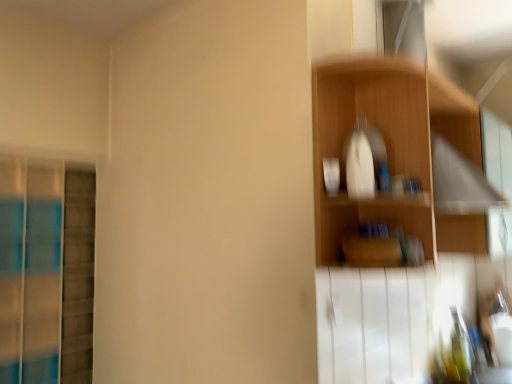
Question: Should I look upward or downward to see wooden shelf at upper right?

Choices:
 (A) down
 (B) up

Answer: (B)

Question: Is blue glass screen door at left bigger than wooden shelf at upper right?

Choices:
 (A) no
 (B) yes

Answer: (B)

Question: Is blue glass screen door at left aimed at wooden shelf at upper right?

Choices:
 (A) yes
 (B) no

Answer: (A)

Question: Is blue glass screen door at left turned away from wooden shelf at upper right?

Choices:
 (A) no
 (B) yes

Answer: (A)

Question: From a real-world perspective, is blue glass screen door at left physically below wooden shelf at upper right?

Choices:
 (A) yes
 (B) no

Answer: (A)

Question: From a real-world perspective, is blue glass screen door at left on top of wooden shelf at upper right?

Choices:
 (A) yes
 (B) no

Answer: (B)

Question: Can we say blue glass screen door at left lies outside wooden shelf at upper right?

Choices:
 (A) yes
 (B) no

Answer: (A)

Question: Can you confirm if wooden shelf at upper right is thinner than blue glass screen door at left?

Choices:
 (A) no
 (B) yes

Answer: (A)

Question: From the image's perspective, does wooden shelf at upper right appear lower than blue glass screen door at left?

Choices:
 (A) no
 (B) yes

Answer: (A)

Question: Is the position of wooden shelf at upper right less distant than that of blue glass screen door at left?

Choices:
 (A) no
 (B) yes

Answer: (B)

Question: Is wooden shelf at upper right far from blue glass screen door at left?

Choices:
 (A) no
 (B) yes

Answer: (B)

Question: Is wooden shelf at upper right at the right side of blue glass screen door at left?

Choices:
 (A) no
 (B) yes

Answer: (B)

Question: Is wooden shelf at upper right not within blue glass screen door at left?

Choices:
 (A) yes
 (B) no

Answer: (A)

Question: Based on their positions, is blue glass screen door at left located to the left or right of wooden shelf at upper right?

Choices:
 (A) left
 (B) right

Answer: (A)